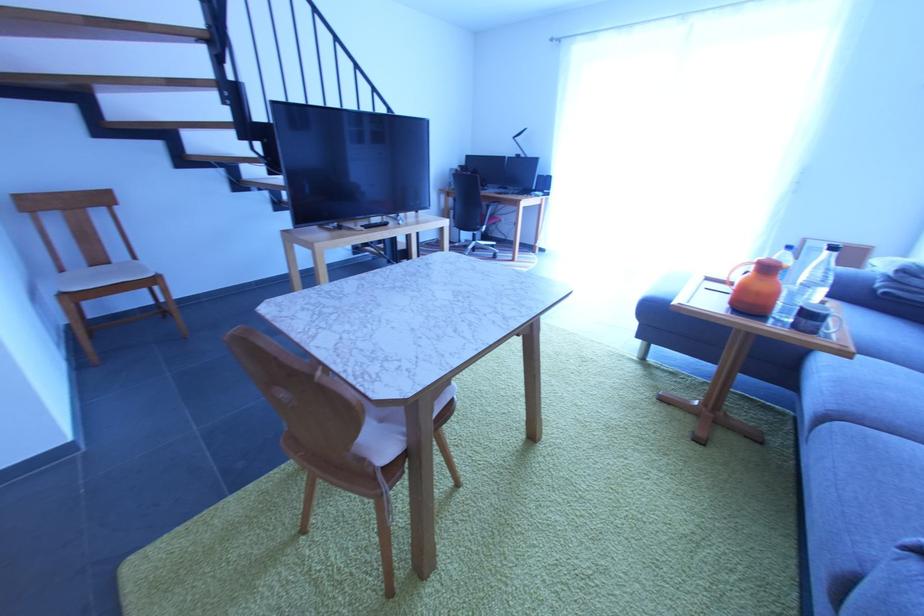
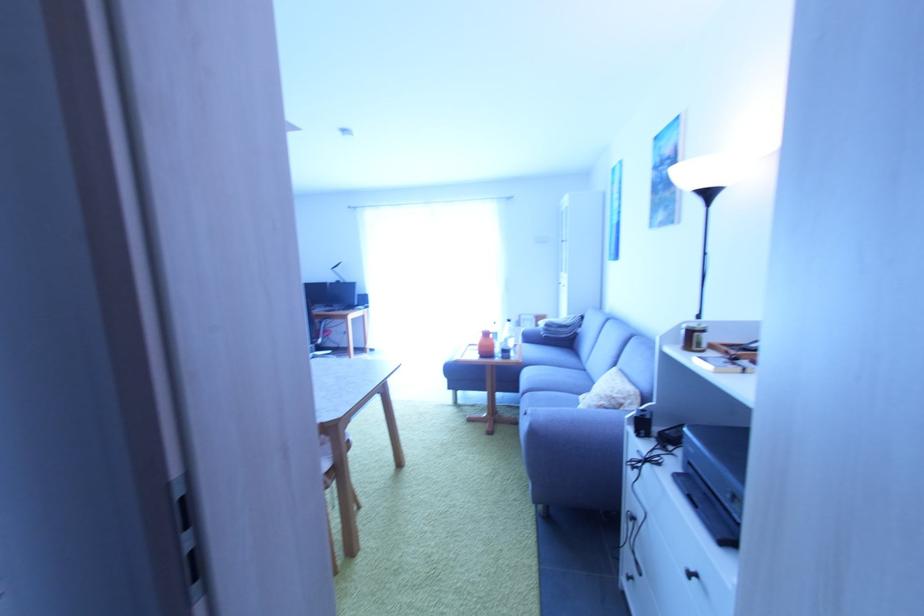
Locate, in the second image, the point that corresponds to the point at 799,329 in the first image.

(507, 360)